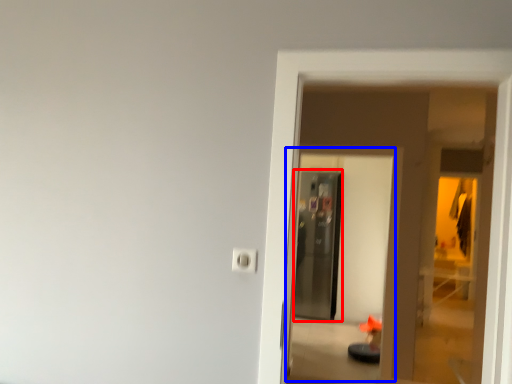
Question: Which point is closer to the camera, screen door (highlighted by a red box) or screen door (highlighted by a blue box)?

Choices:
 (A) screen door
 (B) screen door

Answer: (B)